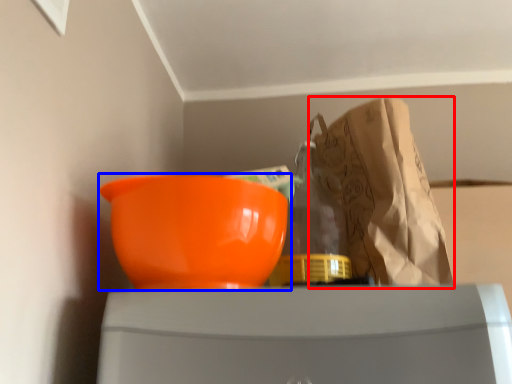
Question: Which of the following is the closest to the observer, grocery bag (highlighted by a red box) or bowl (highlighted by a blue box)?

Choices:
 (A) grocery bag
 (B) bowl

Answer: (B)